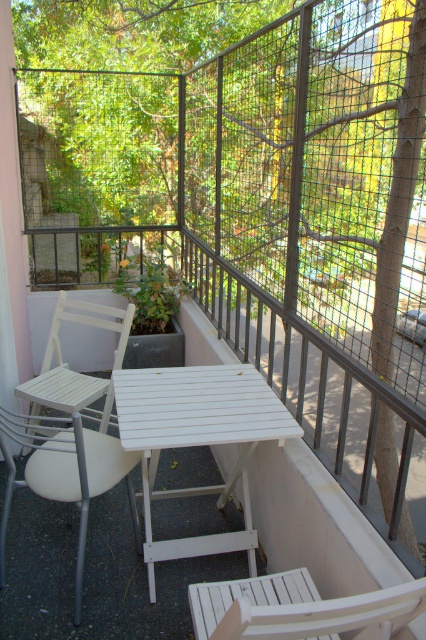
You are a visitor on the balcony and want to sit down. You notice two chairs. Which chair is shorter in height between the white wood chair at lower center and the white wood chair at left?

The white wood chair at lower center is shorter in height compared to the white wood chair at left.

You are standing on the balcony and want to place a small potted plant exactly at point (198, 440). According to the scene description, where should you place the plant?

You should place the small potted plant on the white wood table at center because the point (198, 440) is located there.

You are standing on the balcony and want to place a new potted plant exactly where the white wood chair at lower center is currently located. According to the coordinates provided, what are the 2D coordinates where you should place the new plant?

The white wood chair at lower center is located at coordinates [325,616], so you should place the new potted plant at those coordinates.